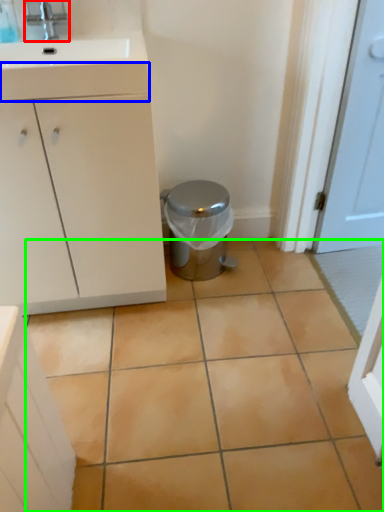
Question: Which is farther away from tap (highlighted by a red box)? drawer (highlighted by a blue box) or ceramic tile (highlighted by a green box)?

Choices:
 (A) drawer
 (B) ceramic tile

Answer: (B)